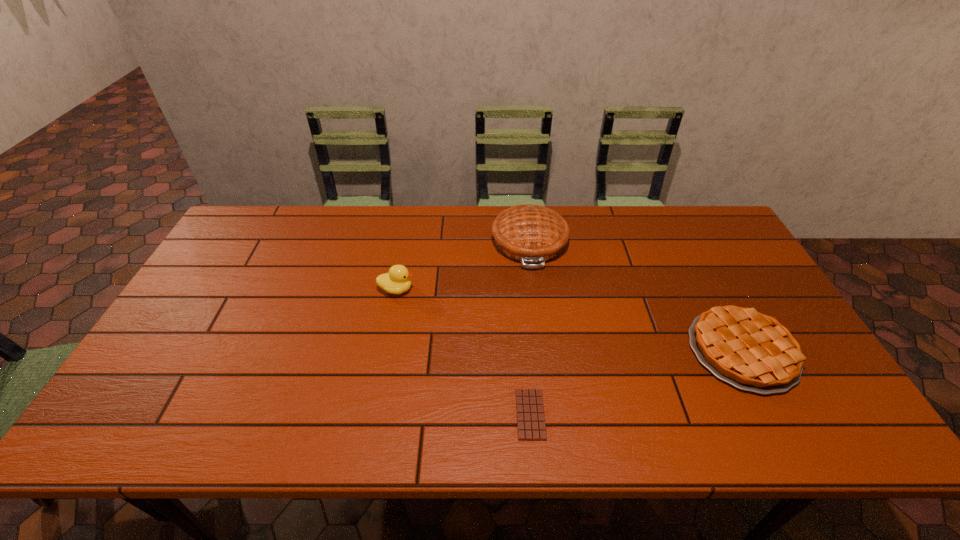
Locate an element on the screen. vacant space positioned on the right of the shortest object is located at coordinates (601, 414).

You are a GUI agent. You are given a task and a screenshot of the screen. Output one action in this format:
    pyautogui.click(x=<x>, y=<y>)
    Task: Click on the object that is at the far edge
    
    Given the screenshot: What is the action you would take?
    pyautogui.click(x=530, y=234)

You are a GUI agent. You are given a task and a screenshot of the screen. Output one action in this format:
    pyautogui.click(x=<x>, y=<y>)
    Task: Click on the object that is at the near edge
    The height and width of the screenshot is (540, 960).
    Given the screenshot: What is the action you would take?
    531,426

The width and height of the screenshot is (960, 540). Identify the location of object at the right edge. (753, 352).

In the image, there is a desktop. At what (x,y) coordinates should I click in order to perform the action: click on vacant space at the far edge. Please return your answer as a coordinate pair (x, y). Looking at the image, I should click on (344, 230).

Where is `free region at the near edge`? free region at the near edge is located at coordinates (295, 435).

In the image, there is a desktop. At what (x,y) coordinates should I click in order to perform the action: click on vacant area at the left edge. Please return your answer as a coordinate pair (x, y). Looking at the image, I should click on (223, 299).

What are the coordinates of `vacant area at the right edge` in the screenshot? It's located at (736, 274).

Identify the location of free space at the far left corner of the desktop. (228, 242).

Identify the location of free spot between the farther pie and the second tallest object. Image resolution: width=960 pixels, height=540 pixels. (463, 266).